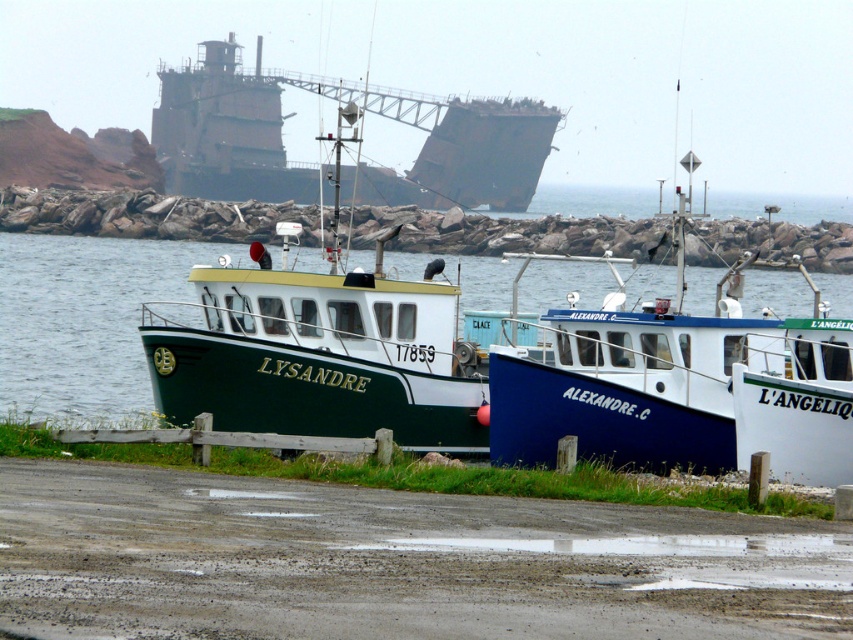
You are standing on the damp gray mud at lower center and want to reach the green matte boat at center. Which direction should you move to get there?

Since the damp gray mud at lower center is closer to the viewer than the green matte boat at center, you should move forward to reach the green matte boat at center.

You are standing on the shore and want to walk to the shipwreck in the background. The damp gray mud at lower center and green matte water at center are both in your path. Which surface should you avoid stepping on to stay dry?

You should avoid stepping on the damp gray mud at lower center because its width is narrower than the green matte water at center, so the water is wider and more likely to be deeper, keeping you drier.